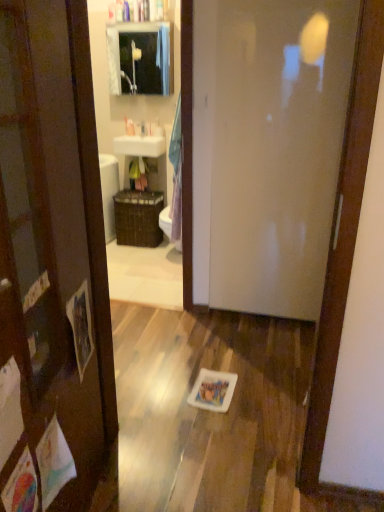
Measure the distance between white glossy sink at upper center and camera.

A distance of 4.02 meters exists between white glossy sink at upper center and camera.

This screenshot has height=512, width=384. Describe the element at coordinates (140, 145) in the screenshot. I see `white glossy sink at upper center` at that location.

Find the location of a particular element. The image size is (384, 512). matte glass mirror at upper center is located at coordinates (140, 58).

In order to face white plastic cup at upper center, acting as the second toiletry starting from the left, should I rotate leftwards or rightwards?

Rotate your view left by about 4.366°.

What are the coordinates of `white plastic soap dispenser at upper center, the first toiletry positioned from the left` in the screenshot? It's located at (129, 127).

Locate an element on the screen. This screenshot has height=512, width=384. white glossy toilet at center is located at coordinates (166, 222).

Does white plastic soap dispenser at upper center, the 2th toiletry when ordered from right to left, have a lesser width compared to matte glass mirror at upper center?

Yes, white plastic soap dispenser at upper center, the 2th toiletry when ordered from right to left, is thinner than matte glass mirror at upper center.

Considering the sizes of objects white plastic soap dispenser at upper center, the first toiletry positioned from the left, and matte glass mirror at upper center in the image provided, who is smaller, white plastic soap dispenser at upper center, the first toiletry positioned from the left, or matte glass mirror at upper center?

With smaller size is white plastic soap dispenser at upper center, the first toiletry positioned from the left.

Considering the points (129, 134) and (170, 54), which point is behind, point (129, 134) or point (170, 54)?

Positioned behind is point (129, 134).

Considering the sizes of objects white plastic soap dispenser at upper center, the first toiletry positioned from the left, and matte glass mirror at upper center in the image provided, who is taller, white plastic soap dispenser at upper center, the first toiletry positioned from the left, or matte glass mirror at upper center?

matte glass mirror at upper center is taller.

Is white plastic soap dispenser at upper center, the 2th toiletry when ordered from right to left, positioned with its back to white glossy door at center?

white plastic soap dispenser at upper center, the 2th toiletry when ordered from right to left, does not have its back to white glossy door at center.

Based on the photo, is white plastic soap dispenser at upper center, the 2th toiletry when ordered from right to left, not within white glossy door at center?

Yes, white plastic soap dispenser at upper center, the 2th toiletry when ordered from right to left, is not within white glossy door at center.

This screenshot has width=384, height=512. I want to click on the 2nd toiletry to the left of the white glossy door at center, counting from the anchor's position, so click(x=129, y=127).

Looking at this image, between white plastic soap dispenser at upper center, the first toiletry positioned from the left, and white glossy door at center, which one has smaller size?

With smaller size is white plastic soap dispenser at upper center, the first toiletry positioned from the left.

Which of these two, white glossy toilet at center or brown woven basket at center, is bigger?

brown woven basket at center is bigger.

Which is correct: white glossy toilet at center is inside brown woven basket at center, or outside of it?

white glossy toilet at center is not enclosed by brown woven basket at center.

Locate an element on the screen. basket above the white glossy toilet at center (from a real-world perspective) is located at coordinates (138, 218).

Is point (168, 216) positioned in front of point (162, 238)?

Yes, it is.

Who is smaller, white plastic soap dispenser at upper center, the 2th toiletry when ordered from right to left, or brown woven basket at center?

Smaller between the two is white plastic soap dispenser at upper center, the 2th toiletry when ordered from right to left.

From a real-world perspective, is white plastic soap dispenser at upper center, the first toiletry positioned from the left, on top of brown woven basket at center?

Yes, from a real-world perspective, white plastic soap dispenser at upper center, the first toiletry positioned from the left, is above brown woven basket at center.

Is white plastic soap dispenser at upper center, the first toiletry positioned from the left, further to the viewer compared to brown woven basket at center?

Yes, it is behind brown woven basket at center.

Is white plastic soap dispenser at upper center, the 2th toiletry when ordered from right to left, far away from brown woven basket at center?

No, white plastic soap dispenser at upper center, the 2th toiletry when ordered from right to left, is in close proximity to brown woven basket at center.

Which is behind, point (127, 125) or point (139, 147)?

The point (127, 125) is farther from the camera.

Which is more to the right, white plastic soap dispenser at upper center, the 2th toiletry when ordered from right to left, or white glossy sink at upper center?

white glossy sink at upper center.

Looking at this image, does white plastic soap dispenser at upper center, the 2th toiletry when ordered from right to left, have a smaller size compared to white glossy sink at upper center?

Correct, white plastic soap dispenser at upper center, the 2th toiletry when ordered from right to left, occupies less space than white glossy sink at upper center.

Between point (166, 230) and point (127, 40), which one is positioned behind?

The point (127, 40) is farther.

Image resolution: width=384 pixels, height=512 pixels. Find the location of `toilet below the matte glass mirror at upper center (from a real-world perspective)`. toilet below the matte glass mirror at upper center (from a real-world perspective) is located at coordinates (166, 222).

How far apart are white glossy toilet at center and matte glass mirror at upper center?

white glossy toilet at center and matte glass mirror at upper center are 1.57 meters apart from each other.

Which is behind, point (120, 49) or point (306, 127)?

Point (120, 49)

From a real-world perspective, is matte glass mirror at upper center physically below white glossy door at center?

Actually, matte glass mirror at upper center is physically above white glossy door at center in the real world.

Measure the distance between matte glass mirror at upper center and white glossy door at center.

1.94 meters.

Which object is closer to the camera, matte glass mirror at upper center or white glossy door at center?

white glossy door at center is closer to the camera.

This screenshot has width=384, height=512. In order to click on cabinetry located on the right of white plastic soap dispenser at upper center, the 2th toiletry when ordered from right to left in this screenshot , I will do `click(140, 58)`.

Locate an element on the screen. This screenshot has height=512, width=384. the 2nd toiletry positioned above the white glossy door at center (from the image's perspective) is located at coordinates (129, 127).

Looking at this image, when comparing their distances from brown woven basket at center, does matte glass mirror at upper center or white glossy toilet at center seem closer?

The object closer to brown woven basket at center is white glossy toilet at center.

Based on their spatial positions, is brown woven basket at center or white glossy toilet at center closer to white plastic cup at upper center, acting as the second toiletry starting from the left?

Among the two, brown woven basket at center is located nearer to white plastic cup at upper center, acting as the second toiletry starting from the left.

Estimate the real-world distances between objects in this image. Which object is closer to brown woven basket at center, white plastic cup at upper center, acting as the second toiletry starting from the left, or white plastic soap dispenser at upper center, the first toiletry positioned from the left?

white plastic cup at upper center, acting as the second toiletry starting from the left.

Considering their positions, is white plastic cup at upper center, the 1th toiletry when ordered from right to left, positioned further to white glossy sink at upper center than white glossy toilet at center?

The object further to white glossy sink at upper center is white glossy toilet at center.

Considering their positions, is white glossy sink at upper center positioned closer to white plastic cup at upper center, the 1th toiletry when ordered from right to left, than white plastic soap dispenser at upper center, the first toiletry positioned from the left?

white glossy sink at upper center is positioned closer to the anchor white plastic cup at upper center, the 1th toiletry when ordered from right to left.

Looking at the image, which one is located closer to white plastic soap dispenser at upper center, the first toiletry positioned from the left, matte glass mirror at upper center or white glossy sink at upper center?

white glossy sink at upper center lies closer to white plastic soap dispenser at upper center, the first toiletry positioned from the left, than the other object.

Looking at the image, which one is located closer to white glossy toilet at center, white glossy sink at upper center or white plastic soap dispenser at upper center, the first toiletry positioned from the left?

The object closer to white glossy toilet at center is white glossy sink at upper center.

Estimate the real-world distances between objects in this image. Which object is further from white glossy door at center, matte glass mirror at upper center or white plastic cup at upper center, acting as the second toiletry starting from the left?

white plastic cup at upper center, acting as the second toiletry starting from the left, is positioned further to the anchor white glossy door at center.

This screenshot has width=384, height=512. Find the location of `cabinetry between white glossy door at center and white glossy sink at upper center from front to back`. cabinetry between white glossy door at center and white glossy sink at upper center from front to back is located at coordinates (140, 58).

The image size is (384, 512). Identify the location of sink between white plastic cup at upper center, the 1th toiletry when ordered from right to left, and white glossy toilet at center from top to bottom. (140, 145).

Identify the location of sink that lies between white plastic cup at upper center, the 1th toiletry when ordered from right to left, and brown woven basket at center from top to bottom. This screenshot has height=512, width=384. (140, 145).

Where is `sink between matte glass mirror at upper center and white glossy toilet at center in the up-down direction`? sink between matte glass mirror at upper center and white glossy toilet at center in the up-down direction is located at coordinates (140, 145).